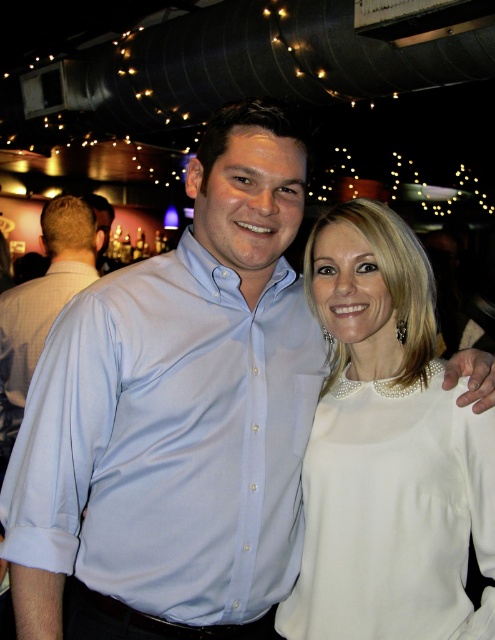
Question: Can you confirm if light blue satin shirt at center is thinner than light blue shirt at center?

Choices:
 (A) no
 (B) yes

Answer: (A)

Question: Which object is farther from the camera taking this photo?

Choices:
 (A) light blue shirt at center
 (B) light blue satin shirt at center

Answer: (A)

Question: Which object is positioned closest to the light blue shirt at center?

Choices:
 (A) light blue satin shirt at center
 (B) white satin blouse at center

Answer: (A)

Question: Which point is farther to the camera?

Choices:
 (A) (68, 220)
 (B) (327, 275)
 (C) (49, 541)

Answer: (A)

Question: Is light blue satin shirt at center below light blue shirt at center?

Choices:
 (A) yes
 (B) no

Answer: (A)

Question: Can you confirm if white satin blouse at center is positioned above light blue shirt at center?

Choices:
 (A) no
 (B) yes

Answer: (A)